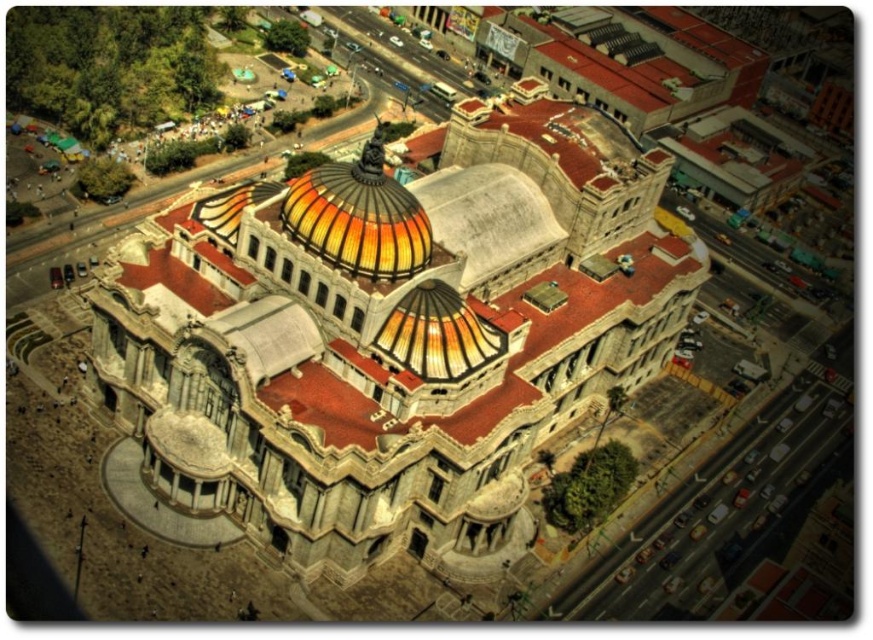
You are standing on the street in front of the building. You see the matte stone church at center and the translucent glass dome at center. Which one is positioned to the right side from your viewpoint?

The matte stone church at center is positioned to the right of the translucent glass dome at center, so the matte stone church at center is on the right side from your viewpoint.

You are a drone operator flying a drone over the city. You need to capture a photo of the matte stone church at center and the translucent glass dome at center. Which one will appear larger in the photo?

The matte stone church at center will appear larger in the photo because it is closer to the viewer than the translucent glass dome at center.